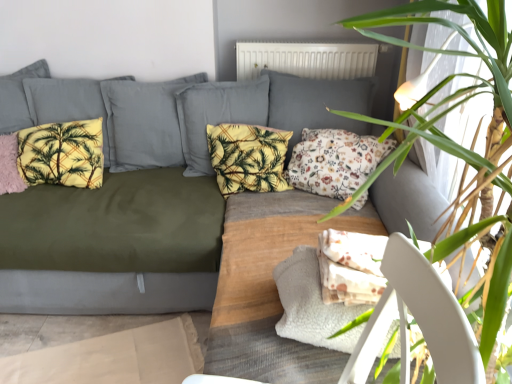
The width and height of the screenshot is (512, 384). Identify the location of pink fluffy pillow at left, placed as the 1th pillow when sorted from left to right. (10, 165).

Describe the element at coordinates (10, 165) in the screenshot. The width and height of the screenshot is (512, 384). I see `pink fluffy pillow at left, placed as the 1th pillow when sorted from left to right` at that location.

The image size is (512, 384). In order to click on yellow fabric pillow at center, marked as the second pillow in a right-to-left arrangement in this screenshot , I will do `click(248, 157)`.

How much space does floral fabric pillow at center, arranged as the fourth pillow when viewed from the left, occupy horizontally?

14.23 inches.

What do you see at coordinates (334, 161) in the screenshot?
I see `floral fabric pillow at center, acting as the 1th pillow starting from the right` at bounding box center [334, 161].

Locate an element on the screen. olive-green fabric couch at center is located at coordinates (115, 217).

Can we say yellow fleece pillow at left, marked as the 3th pillow in a right-to-left arrangement, lies outside floral fabric pillow at center, arranged as the fourth pillow when viewed from the left?

Yes, yellow fleece pillow at left, marked as the 3th pillow in a right-to-left arrangement, is located beyond the bounds of floral fabric pillow at center, arranged as the fourth pillow when viewed from the left.

Is yellow fleece pillow at left, the second pillow viewed from the left, to the right of floral fabric pillow at center, arranged as the fourth pillow when viewed from the left, from the viewer's perspective?

No.

Considering the sizes of yellow fleece pillow at left, marked as the 3th pillow in a right-to-left arrangement, and floral fabric pillow at center, arranged as the fourth pillow when viewed from the left, in the image, is yellow fleece pillow at left, marked as the 3th pillow in a right-to-left arrangement, wider or thinner than floral fabric pillow at center, arranged as the fourth pillow when viewed from the left,?

Considering their sizes, yellow fleece pillow at left, marked as the 3th pillow in a right-to-left arrangement, looks slimmer than floral fabric pillow at center, arranged as the fourth pillow when viewed from the left.

This screenshot has width=512, height=384. Identify the location of pillow that is the 3rd one when counting backward from the floral fabric pillow at center, acting as the 1th pillow starting from the right. (62, 154).

Which object is closer to the camera, olive-green fabric couch at center or green leafy plant at upper right?

green leafy plant at upper right is more forward.

I want to click on houseplant in front of the olive-green fabric couch at center, so click(461, 146).

Looking at their sizes, would you say olive-green fabric couch at center is wider or thinner than green leafy plant at upper right?

Considering their sizes, olive-green fabric couch at center looks broader than green leafy plant at upper right.

Measure the distance from olive-green fabric couch at center to green leafy plant at upper right.

A distance of 1.18 meters exists between olive-green fabric couch at center and green leafy plant at upper right.

Is white matte radiator at upper center facing away from floral fabric pillow at center, arranged as the fourth pillow when viewed from the left?

No, white matte radiator at upper center is not facing away from floral fabric pillow at center, arranged as the fourth pillow when viewed from the left.

Can you confirm if white matte radiator at upper center is smaller than floral fabric pillow at center, acting as the 1th pillow starting from the right?

Correct, white matte radiator at upper center occupies less space than floral fabric pillow at center, acting as the 1th pillow starting from the right.

From a real-world perspective, between white matte radiator at upper center and floral fabric pillow at center, acting as the 1th pillow starting from the right, who is vertically lower?

floral fabric pillow at center, acting as the 1th pillow starting from the right.

Would you say white matte radiator at upper center contains floral fabric pillow at center, acting as the 1th pillow starting from the right?

No, floral fabric pillow at center, acting as the 1th pillow starting from the right, is not surrounded by white matte radiator at upper center.

What's the angular difference between white matte radiator at upper center and green leafy plant at upper right's facing directions?

The angle between the facing direction of white matte radiator at upper center and the facing direction of green leafy plant at upper right is 91.7 degrees.

Where is `radiator behind the green leafy plant at upper right`? This screenshot has width=512, height=384. radiator behind the green leafy plant at upper right is located at coordinates (306, 59).

Is white matte radiator at upper center taller or shorter than green leafy plant at upper right?

Considering their sizes, white matte radiator at upper center has less height than green leafy plant at upper right.

Considering the relative positions of white matte radiator at upper center and green leafy plant at upper right in the image provided, is white matte radiator at upper center to the left of green leafy plant at upper right from the viewer's perspective?

Yes.

From a real-world perspective, is green leafy plant at upper right above or below floral fabric pillow at center, acting as the 1th pillow starting from the right?

green leafy plant at upper right is situated higher than floral fabric pillow at center, acting as the 1th pillow starting from the right, in the real world.

In terms of height, does green leafy plant at upper right look taller or shorter compared to floral fabric pillow at center, acting as the 1th pillow starting from the right?

Considering their sizes, green leafy plant at upper right has more height than floral fabric pillow at center, acting as the 1th pillow starting from the right.

From the image's perspective, between green leafy plant at upper right and floral fabric pillow at center, arranged as the fourth pillow when viewed from the left, which one is located above?

floral fabric pillow at center, arranged as the fourth pillow when viewed from the left.

Is green leafy plant at upper right facing away from floral fabric pillow at center, acting as the 1th pillow starting from the right?

No, green leafy plant at upper right's orientation is not away from floral fabric pillow at center, acting as the 1th pillow starting from the right.

Does white matte radiator at upper center appear on the left side of olive-green fabric couch at center?

Incorrect, white matte radiator at upper center is not on the left side of olive-green fabric couch at center.

From the picture: Considering the sizes of white matte radiator at upper center and olive-green fabric couch at center in the image, is white matte radiator at upper center bigger or smaller than olive-green fabric couch at center?

Clearly, white matte radiator at upper center is smaller in size than olive-green fabric couch at center.

Is white matte radiator at upper center not close to olive-green fabric couch at center?

No, white matte radiator at upper center is in close proximity to olive-green fabric couch at center.

Is white matte radiator at upper center looking in the opposite direction of olive-green fabric couch at center?

No, white matte radiator at upper center is not facing the opposite direction of olive-green fabric couch at center.

Between point (232, 101) and point (254, 179), which one is positioned in front?

The point (254, 179) is more forward.

Is olive-green fabric couch at center aimed at yellow fabric pillow at center, marked as the second pillow in a right-to-left arrangement?

Yes, olive-green fabric couch at center is aimed at yellow fabric pillow at center, marked as the second pillow in a right-to-left arrangement.

From a real-world perspective, which is physically above, olive-green fabric couch at center or yellow fabric pillow at center, positioned as the third pillow in left-to-right order?

yellow fabric pillow at center, positioned as the third pillow in left-to-right order.

Is olive-green fabric couch at center to the left or to the right of yellow fabric pillow at center, positioned as the third pillow in left-to-right order, in the image?

Clearly, olive-green fabric couch at center is on the left of yellow fabric pillow at center, positioned as the third pillow in left-to-right order, in the image.

Where is `pillow that is the 2nd object directly below the yellow fleece pillow at left, the second pillow viewed from the left (from a real-world perspective)`? pillow that is the 2nd object directly below the yellow fleece pillow at left, the second pillow viewed from the left (from a real-world perspective) is located at coordinates (334, 161).

Locate an element on the screen. This screenshot has width=512, height=384. studio couch located above the green leafy plant at upper right (from the image's perspective) is located at coordinates (115, 217).

Considering their positions, is pink fluffy pillow at left, placed as the 1th pillow when sorted from left to right, positioned closer to white matte radiator at upper center than yellow fabric pillow at center, positioned as the third pillow in left-to-right order?

yellow fabric pillow at center, positioned as the third pillow in left-to-right order, is positioned closer to the anchor white matte radiator at upper center.

Considering their positions, is green leafy plant at upper right positioned further to olive-green fabric couch at center than yellow fabric pillow at center, marked as the second pillow in a right-to-left arrangement?

Among the two, green leafy plant at upper right is located further to olive-green fabric couch at center.

Looking at the image, which one is located further to yellow fabric pillow at center, marked as the second pillow in a right-to-left arrangement, olive-green fabric couch at center or white matte radiator at upper center?

white matte radiator at upper center lies further to yellow fabric pillow at center, marked as the second pillow in a right-to-left arrangement, than the other object.

Looking at the image, which one is located further to floral fabric pillow at center, acting as the 1th pillow starting from the right, pink fluffy pillow at left, placed as the 1th pillow when sorted from left to right, or white matte radiator at upper center?

pink fluffy pillow at left, placed as the 1th pillow when sorted from left to right, lies further to floral fabric pillow at center, acting as the 1th pillow starting from the right, than the other object.

From the image, which object appears to be farther from pink fluffy pillow at left, the fourth pillow positioned from the right, yellow fleece pillow at left, marked as the 3th pillow in a right-to-left arrangement, or floral fabric pillow at center, acting as the 1th pillow starting from the right?

The object further to pink fluffy pillow at left, the fourth pillow positioned from the right, is floral fabric pillow at center, acting as the 1th pillow starting from the right.

Which object lies nearer to the anchor point olive-green fabric couch at center, yellow fabric pillow at center, marked as the second pillow in a right-to-left arrangement, or yellow fleece pillow at left, the second pillow viewed from the left?

yellow fleece pillow at left, the second pillow viewed from the left, is closer to olive-green fabric couch at center.

From the image, which object appears to be nearer to white matte radiator at upper center, floral fabric pillow at center, arranged as the fourth pillow when viewed from the left, or olive-green fabric couch at center?

floral fabric pillow at center, arranged as the fourth pillow when viewed from the left, is positioned closer to the anchor white matte radiator at upper center.

Looking at the image, which one is located closer to yellow fabric pillow at center, marked as the second pillow in a right-to-left arrangement, pink fluffy pillow at left, the fourth pillow positioned from the right, or yellow fleece pillow at left, the second pillow viewed from the left?

Based on the image, yellow fleece pillow at left, the second pillow viewed from the left, appears to be nearer to yellow fabric pillow at center, marked as the second pillow in a right-to-left arrangement.

You are a GUI agent. You are given a task and a screenshot of the screen. Output one action in this format:
    pyautogui.click(x=<x>, y=<y>)
    Task: Click on the studio couch located between yellow fleece pillow at left, the second pillow viewed from the left, and floral fabric pillow at center, arranged as the fourth pillow when viewed from the left, in the left-right direction
    Image resolution: width=512 pixels, height=384 pixels.
    Given the screenshot: What is the action you would take?
    pyautogui.click(x=115, y=217)

Where is `pillow between yellow fleece pillow at left, the second pillow viewed from the left, and floral fabric pillow at center, arranged as the fourth pillow when viewed from the left, in the horizontal direction`? Image resolution: width=512 pixels, height=384 pixels. pillow between yellow fleece pillow at left, the second pillow viewed from the left, and floral fabric pillow at center, arranged as the fourth pillow when viewed from the left, in the horizontal direction is located at coordinates (248, 157).

Find the location of a particular element. studio couch between green leafy plant at upper right and yellow fleece pillow at left, marked as the 3th pillow in a right-to-left arrangement, from front to back is located at coordinates (115, 217).

Image resolution: width=512 pixels, height=384 pixels. What are the coordinates of `studio couch between green leafy plant at upper right and yellow fabric pillow at center, marked as the second pillow in a right-to-left arrangement, in the front-back direction` in the screenshot? It's located at (115, 217).